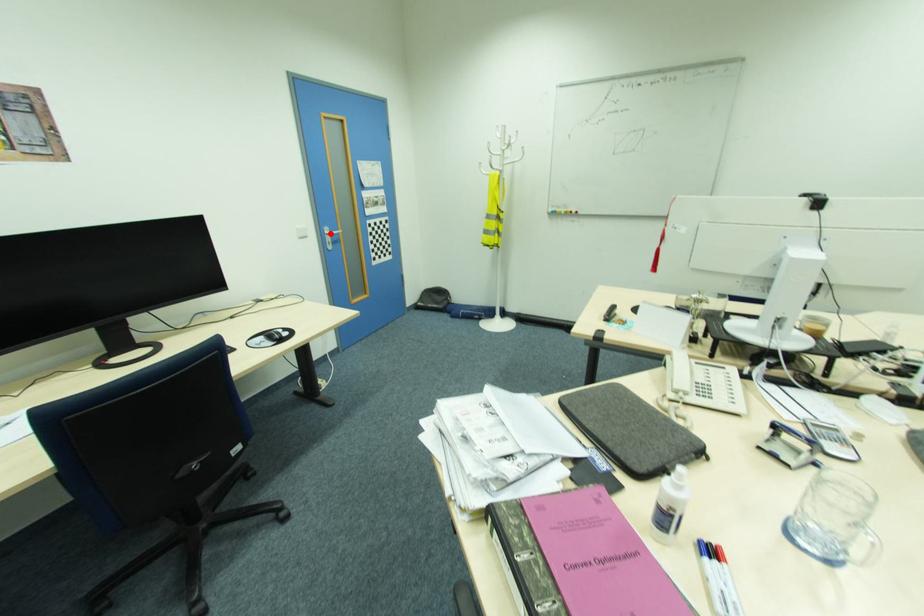
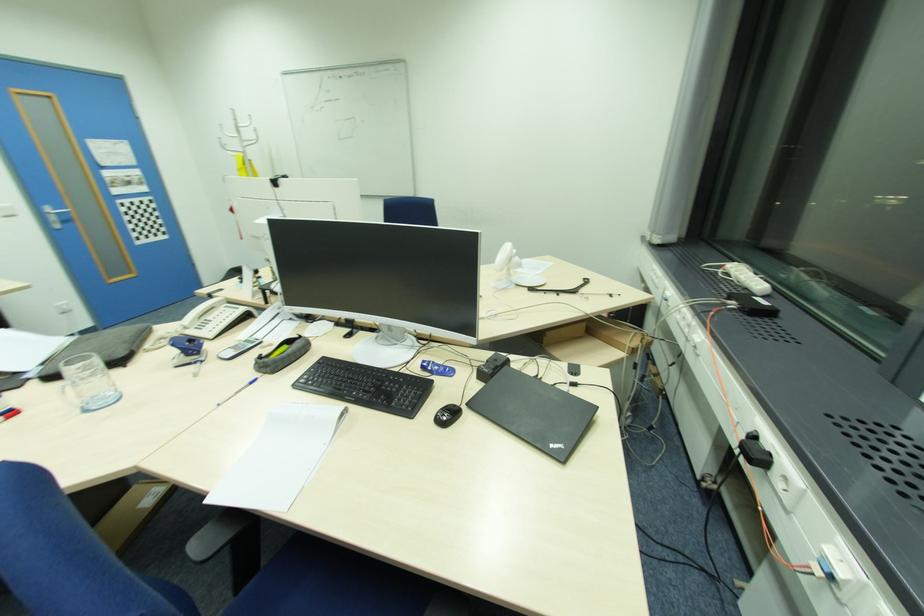
Question: I am providing you with two images of the same scene from different viewpoints. A red point is shown in image1. For the corresponding object point in image2, is it positioned nearer or farther from the camera?

Choices:
 (A) Nearer
 (B) Farther

Answer: (B)